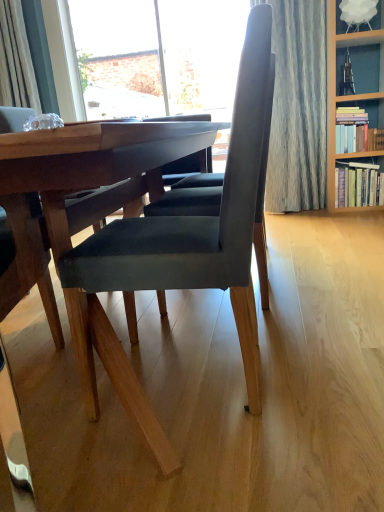
Where is `vacant space to the left of hardcover book at right, the second book in the top-to-bottom sequence`? vacant space to the left of hardcover book at right, the second book in the top-to-bottom sequence is located at coordinates (319, 213).